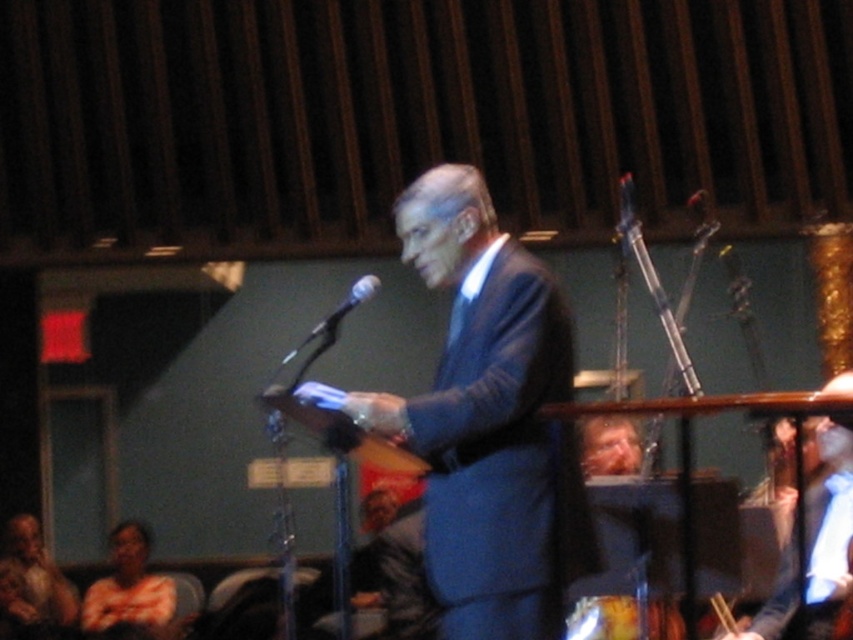
Question: Does orange t-shirt at lower left have a greater width compared to black metallic microphone at center?

Choices:
 (A) no
 (B) yes

Answer: (B)

Question: Can you confirm if blue suit at center is positioned below orange t-shirt at lower left?

Choices:
 (A) yes
 (B) no

Answer: (B)

Question: Which object is closer to the camera taking this photo?

Choices:
 (A) black metallic microphone at center
 (B) blue suit at center

Answer: (B)

Question: Does blue fabric shirt at right appear over black metallic microphone at center?

Choices:
 (A) yes
 (B) no

Answer: (B)

Question: Estimate the real-world distances between objects in this image. Which object is closer to the orange t-shirt at lower left?

Choices:
 (A) blue fabric shirt at right
 (B) black metallic microphone at center
 (C) light brown leather jacket at lower left
 (D) blue suit at center

Answer: (C)

Question: Which point appears closest to the camera in this image?

Choices:
 (A) (329, 326)
 (B) (811, 531)
 (C) (42, 560)
 (D) (532, 444)

Answer: (D)